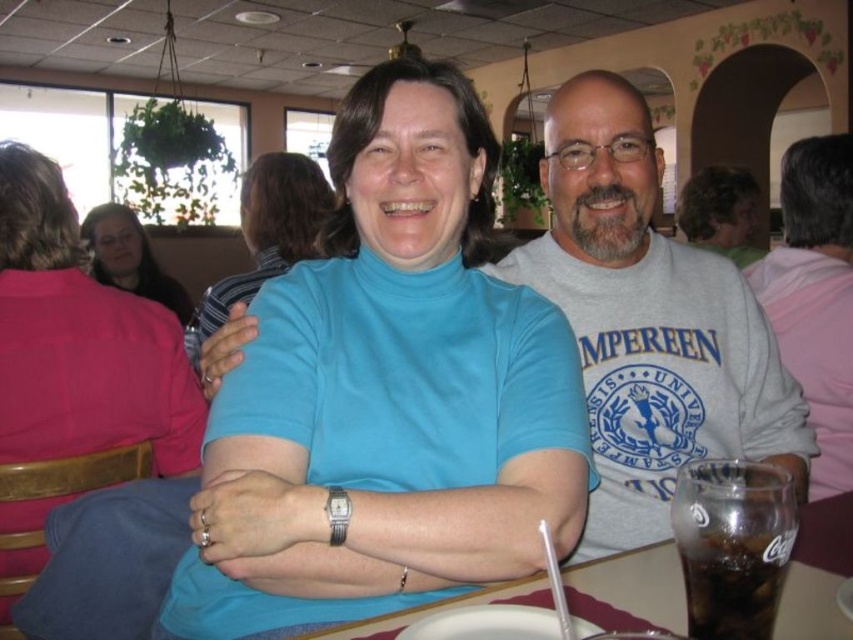
Is gray cotton sweatshirt at center taller than clear plastic cup at lower right?

Correct, gray cotton sweatshirt at center is much taller as clear plastic cup at lower right.

Between gray cotton sweatshirt at center and clear plastic cup at lower right, which one is positioned lower?

clear plastic cup at lower right is below.

Describe the element at coordinates (648, 323) in the screenshot. The image size is (853, 640). I see `gray cotton sweatshirt at center` at that location.

This screenshot has width=853, height=640. What are the coordinates of `gray cotton sweatshirt at center` in the screenshot? It's located at click(648, 323).

Which is behind, point (804, 145) or point (242, 196)?

The point (242, 196) is more distant.

How much distance is there between gray cotton shirt at upper right and blue turtleneck sweater at center?

1.23 meters

Does point (810, 467) come farther from viewer compared to point (322, 176)?

No, it is in front of (322, 176).

Locate an element on the screen. gray cotton shirt at upper right is located at coordinates (815, 296).

Does gray cotton sweatshirt at center have a greater height compared to matte blue turtleneck at center?

No.

Is gray cotton sweatshirt at center behind matte blue turtleneck at center?

That is False.

The height and width of the screenshot is (640, 853). I want to click on gray cotton sweatshirt at center, so click(648, 323).